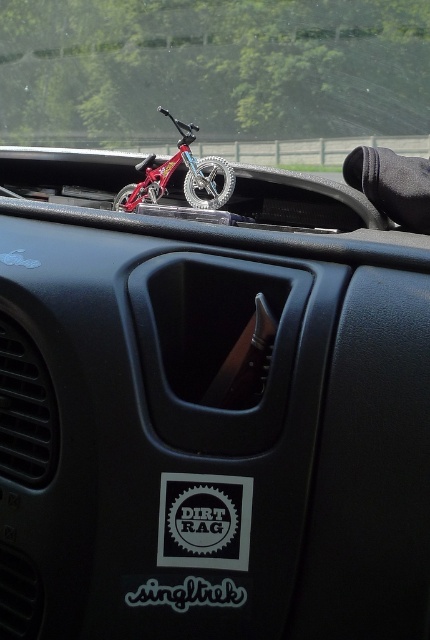
Who is positioned more to the left, clear glass windshield at upper center or metallic red bicycle at center?

Positioned to the left is clear glass windshield at upper center.

Does clear glass windshield at upper center appear over metallic red bicycle at center?

Correct, clear glass windshield at upper center is located above metallic red bicycle at center.

Between point (383, 58) and point (146, 173), which one is positioned behind?

Point (383, 58)

You are a GUI agent. You are given a task and a screenshot of the screen. Output one action in this format:
    pyautogui.click(x=<x>, y=<y>)
    Task: Click on the clear glass windshield at upper center
    
    Given the screenshot: What is the action you would take?
    pyautogui.click(x=211, y=68)